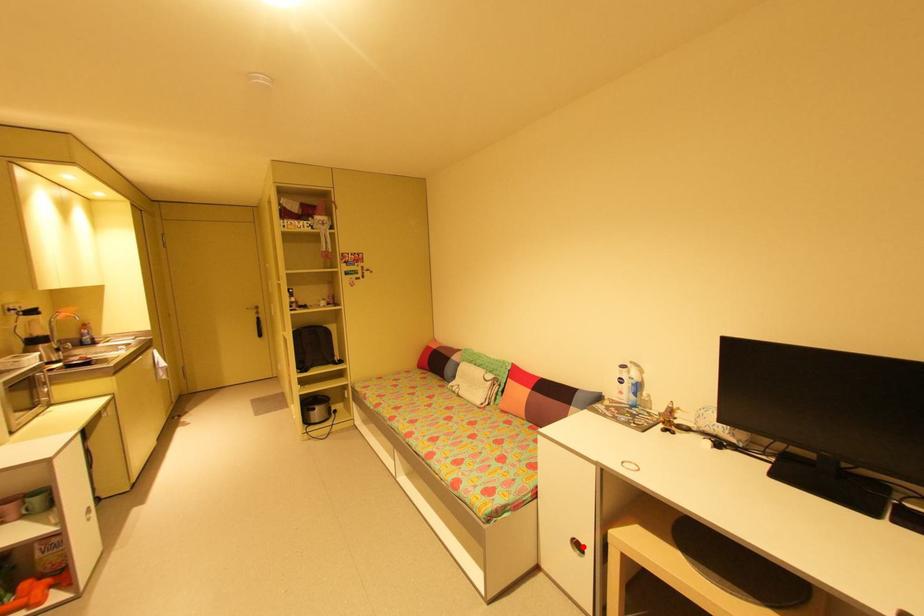
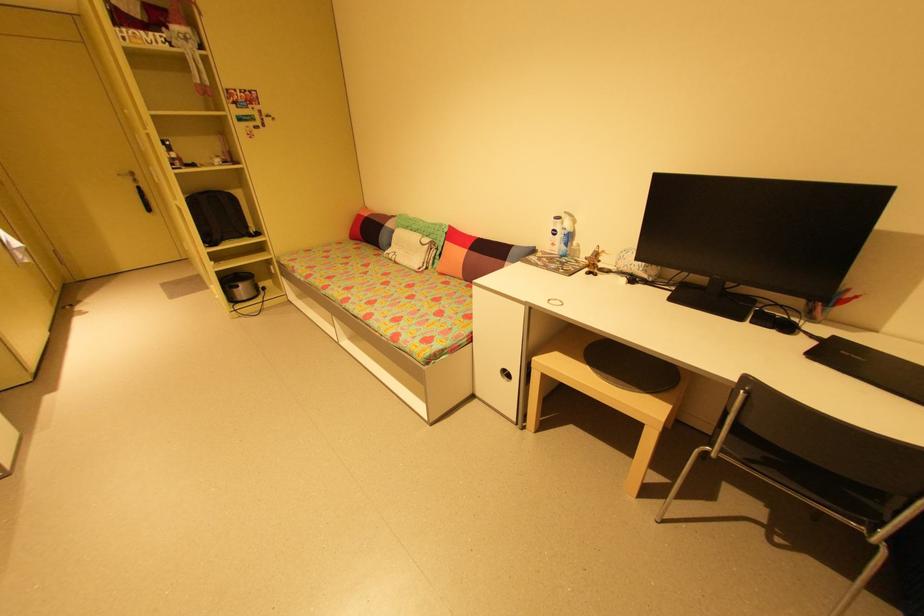
Question: A red point is marked in image1. In image2, is the corresponding 3D point closer to the camera or farther? Reply with the corresponding letter.

Choices:
 (A) The corresponding 3D point is closer.
 (B) The corresponding 3D point is farther.

Answer: (A)